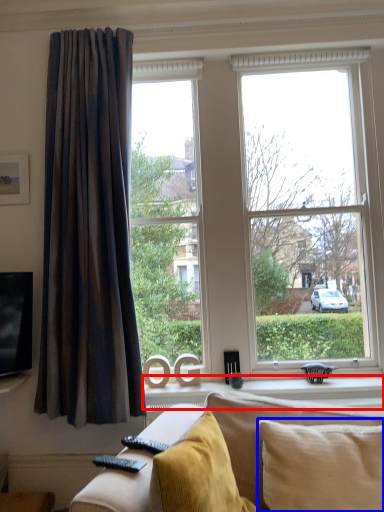
Question: Which of the following is the closest to the observer, window sill (highlighted by a red box) or pillow (highlighted by a blue box)?

Choices:
 (A) window sill
 (B) pillow

Answer: (B)